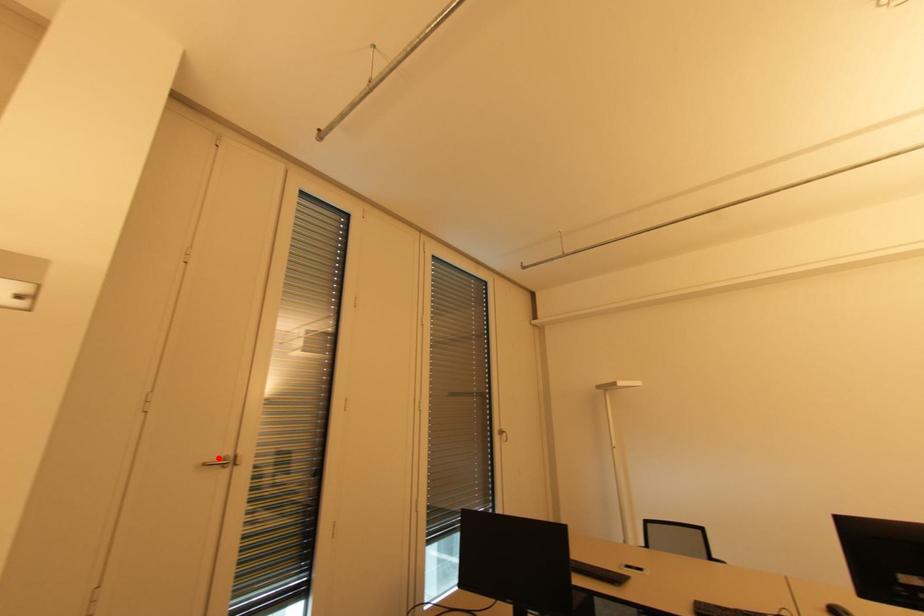
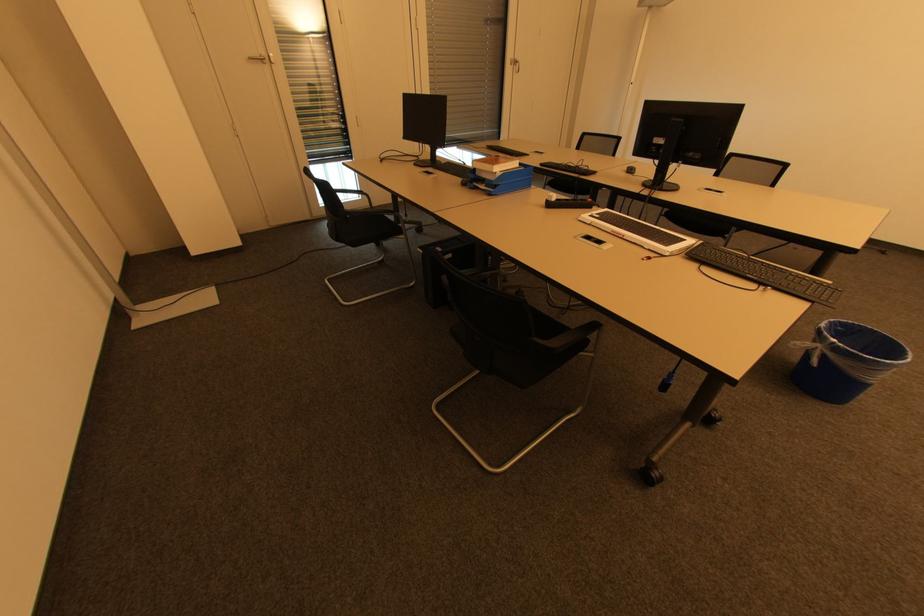
Locate, in the second image, the point that corresponds to the highlighted location in the first image.

(258, 55)